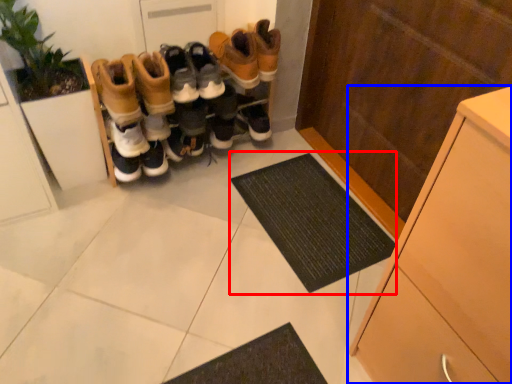
Question: Among these objects, which one is nearest to the camera, doormat (highlighted by a red box) or cabinetry (highlighted by a blue box)?

Choices:
 (A) doormat
 (B) cabinetry

Answer: (B)